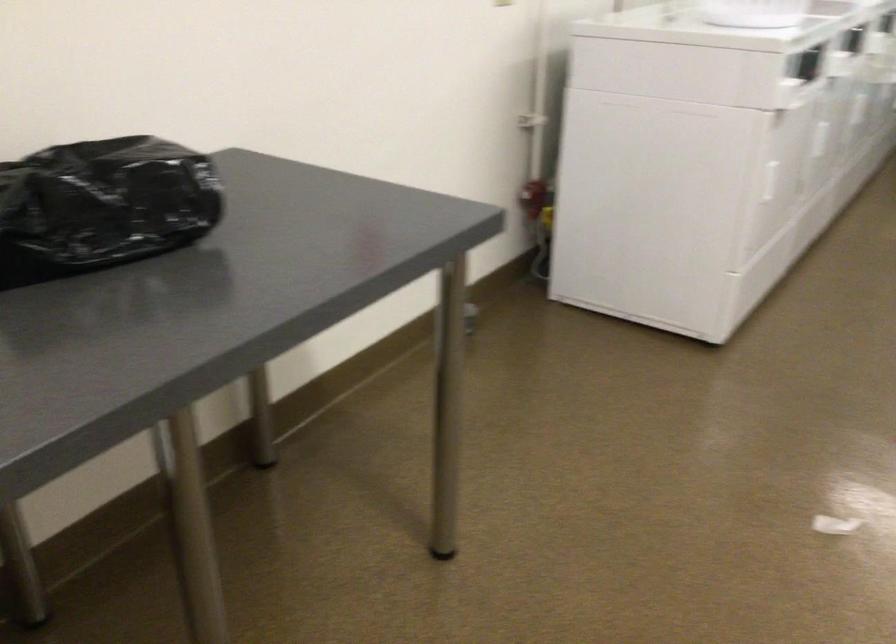
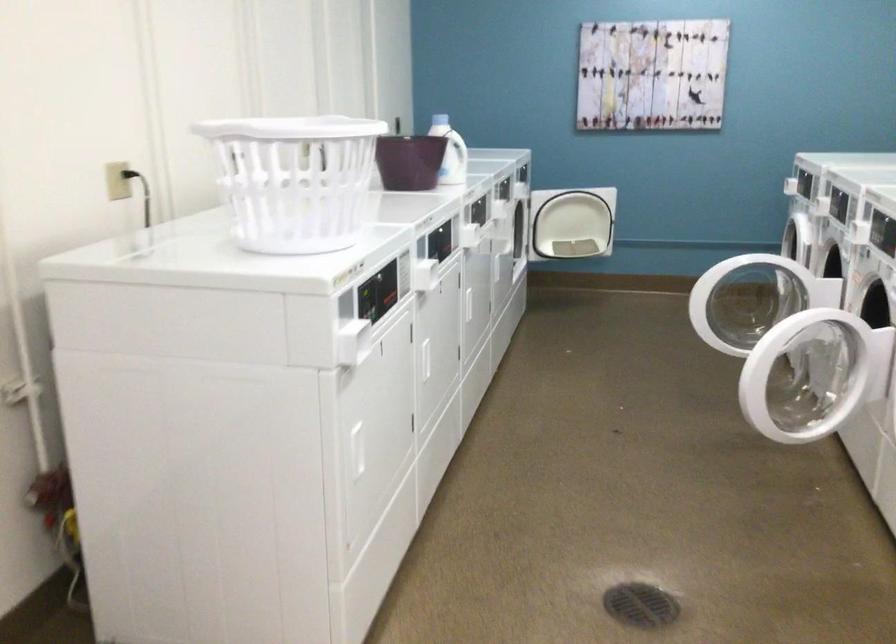
Which direction would the cameraman need to move to produce the second image?

The cameraman moved toward right, forward.